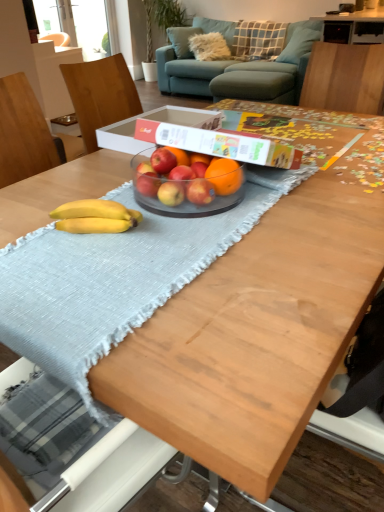
Question: Visually, is red matte apple at center, acting as the 5th apple starting from the right, positioned to the left or to the right of plaid fabric pillow at upper center, placed as the 1th pillow when sorted from back to front?

Choices:
 (A) right
 (B) left

Answer: (B)

Question: From the image's perspective, is red matte apple at center, acting as the 5th apple starting from the right, located above or below plaid fabric pillow at upper center, placed as the 1th pillow when sorted from back to front?

Choices:
 (A) above
 (B) below

Answer: (B)

Question: Which object is positioned closest to the red matte apple at center, the fourth apple viewed from the right?

Choices:
 (A) blue fabric pillow at upper right, marked as the 1th pillow in a front-to-back arrangement
 (B) red matte apple at center, which is the 2th apple in right-to-left order
 (C) wooden chair at upper right
 (D) white cardboard box at center
 (E) red matte apple at center, acting as the 5th apple starting from the right

Answer: (B)

Question: Based on their relative distances, which object is farther from the yellow matte bananas at center?

Choices:
 (A) orange matte at center
 (B) red matte apple at center, which is the second apple from left to right
 (C) red matte apple at center, acting as the 5th apple starting from the right
 (D) red matte apple at center, which is the 2th apple in right-to-left order
 (E) wooden chair at upper right

Answer: (E)